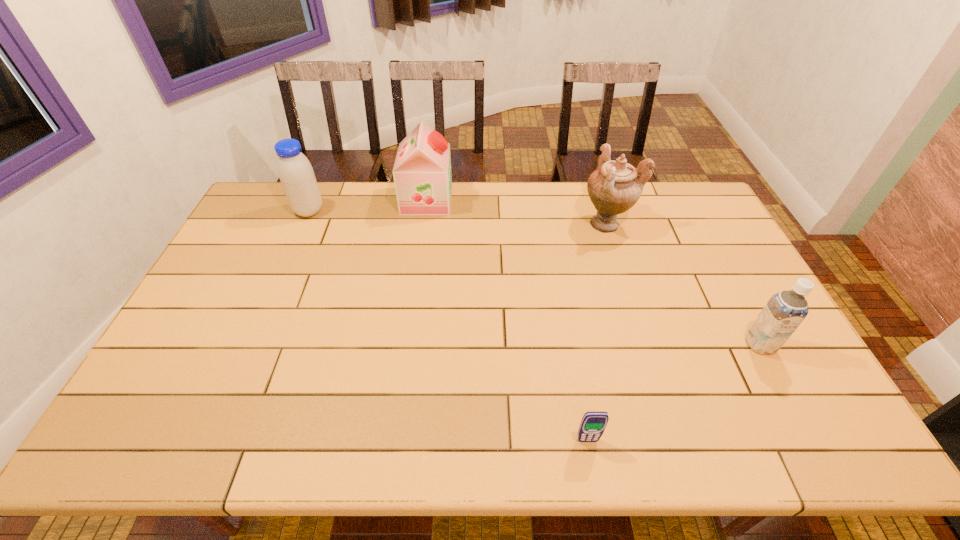
The height and width of the screenshot is (540, 960). Find the location of `vacant space in between the nearest object and the second soya milk from right to left`. vacant space in between the nearest object and the second soya milk from right to left is located at coordinates pos(507,320).

The height and width of the screenshot is (540, 960). Identify the location of object that is the third closest one to the rightmost object. (422, 176).

Locate which object ranks in proximity to the nearest soya milk. Please provide its 2D coordinates. Your answer should be formatted as a tuple, i.e. [(x, y)], where the tuple contains the x and y coordinates of a point satisfying the conditions above.

[(614, 187)]

I want to click on soya milk that is the second closest to the second object from left to right, so click(x=784, y=312).

Locate which soya milk is the closest to the nearest soya milk. Please provide its 2D coordinates. Your answer should be formatted as a tuple, i.e. [(x, y)], where the tuple contains the x and y coordinates of a point satisfying the conditions above.

[(422, 176)]

Locate an element on the screen. This screenshot has width=960, height=540. free space that satisfies the following two spatial constraints: 1. with the cap open on the second object from right to left; 2. on the right side of the second soya milk from left to right is located at coordinates (423, 224).

Find the location of `vacant point that satisfies the following two spatial constraints: 1. on the front side of the leftmost object; 2. on the right side of the second object from right to left`. vacant point that satisfies the following two spatial constraints: 1. on the front side of the leftmost object; 2. on the right side of the second object from right to left is located at coordinates (303, 224).

Identify the location of free space in the image that satisfies the following two spatial constraints: 1. on the back side of the second object from right to left; 2. with the cap open on the second soya milk from left to right. (600, 200).